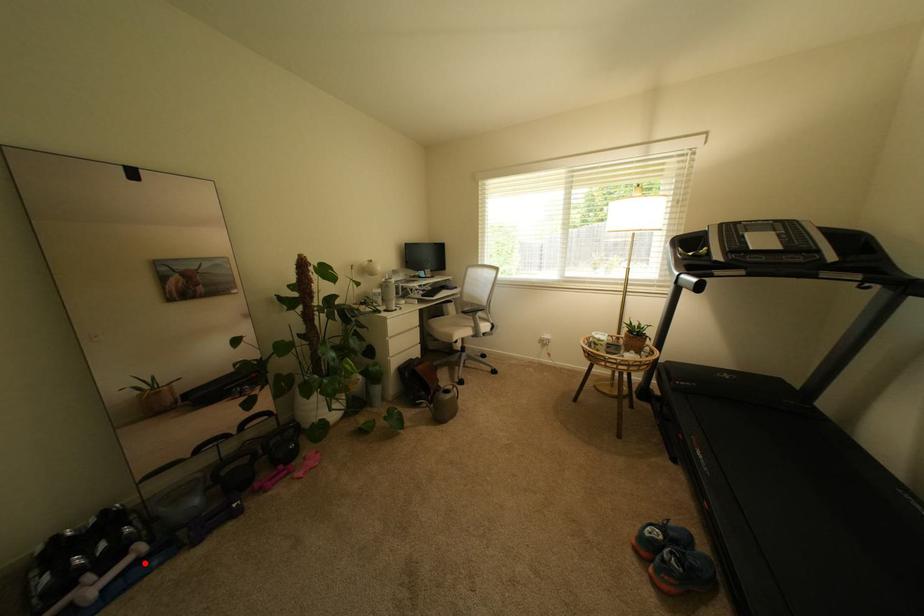
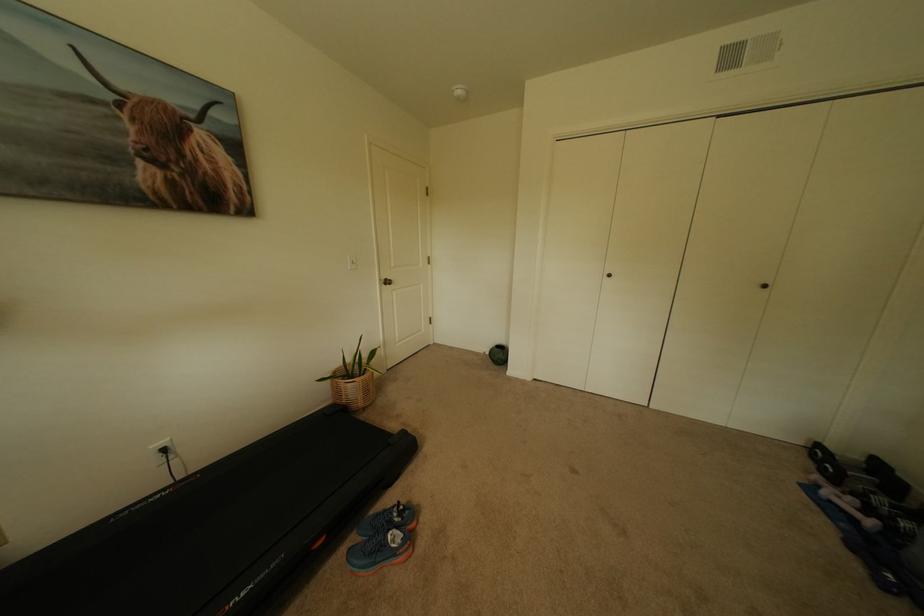
Question: I am providing you with two images of the same scene from different viewpoints. Given a red point in image1, look at the same physical point in image2. Is it:

Choices:
 (A) Closer to the viewpoint
 (B) Farther from the viewpoint

Answer: (A)